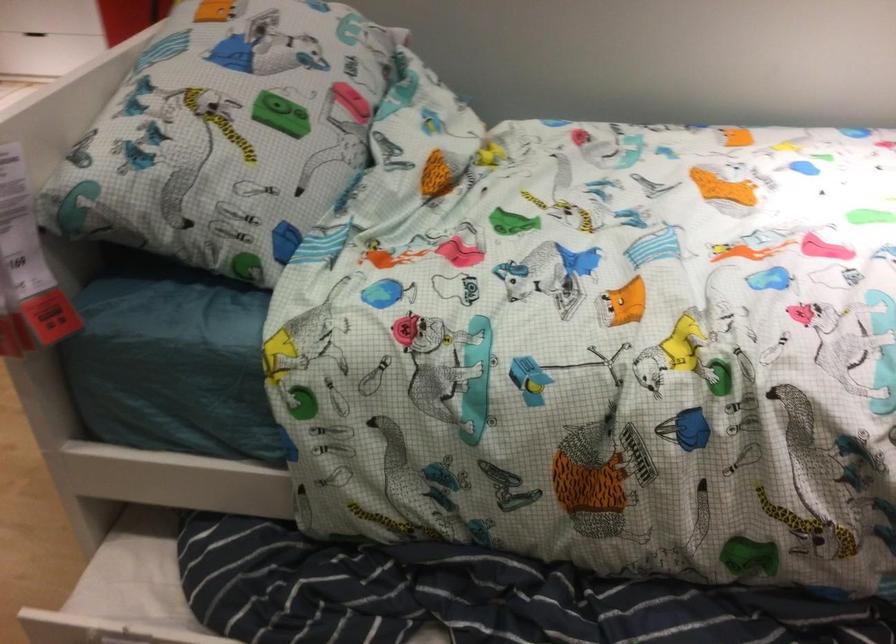
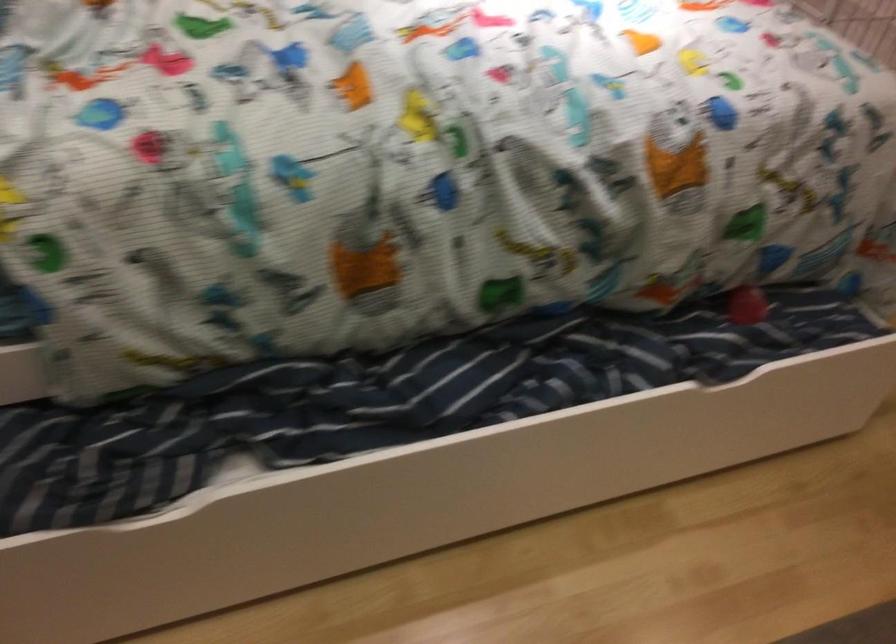
Question: The camera is either moving clockwise (left) or counter-clockwise (right) around the object. The first image is from the beginning of the video and the second image is from the end. Is the camera moving left or right when shooting the video?

Choices:
 (A) Left
 (B) Right

Answer: (A)